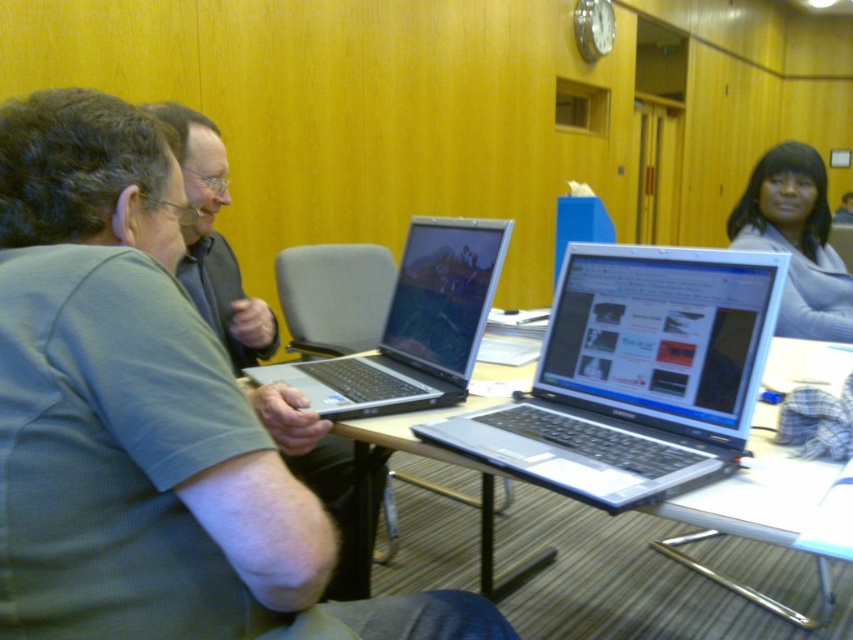
Can you confirm if silver/black laptop at center is smaller than matte gray shirt at left?

Incorrect, silver/black laptop at center is not smaller in size than matte gray shirt at left.

Is point (444, 320) positioned after point (350, 570)?

No.

This screenshot has height=640, width=853. Describe the element at coordinates (415, 326) in the screenshot. I see `silver/black laptop at center` at that location.

At what (x,y) coordinates should I click in order to perform the action: click on silver/black laptop at center. Please return your answer as a coordinate pair (x, y). The image size is (853, 640). Looking at the image, I should click on (415, 326).

Based on the photo, can you confirm if silver/black laptop at center is taller than light blue sweater at upper right?

No, silver/black laptop at center is not taller than light blue sweater at upper right.

Consider the image. Can you confirm if silver/black laptop at center is smaller than light blue sweater at upper right?

Indeed, silver/black laptop at center has a smaller size compared to light blue sweater at upper right.

Between point (309, 390) and point (830, 257), which one is positioned in front?

Point (309, 390) is in front.

Locate an element on the screen. silver/black laptop at center is located at coordinates (415, 326).

Does point (811, 472) come farther from viewer compared to point (303, 388)?

No.

Does silver metallic table at center appear on the right side of silver/black laptop at center?

Yes, silver metallic table at center is to the right of silver/black laptop at center.

What are the coordinates of `silver metallic table at center` in the screenshot? It's located at (752, 516).